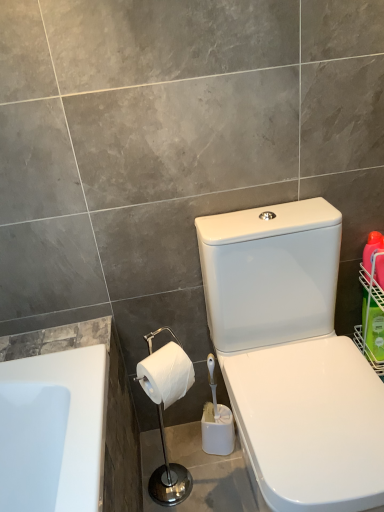
Question: From the image's perspective, is white glossy toilet at center-right beneath green plastic basket at right?

Choices:
 (A) no
 (B) yes

Answer: (B)

Question: Is white glossy toilet at center-right wider than green plastic basket at right?

Choices:
 (A) yes
 (B) no

Answer: (A)

Question: Is white glossy toilet at center-right at the right side of green plastic basket at right?

Choices:
 (A) yes
 (B) no

Answer: (B)

Question: Is white glossy toilet at center-right not close to green plastic basket at right?

Choices:
 (A) no
 (B) yes

Answer: (A)

Question: Is white glossy toilet at center-right turned away from green plastic basket at right?

Choices:
 (A) yes
 (B) no

Answer: (B)

Question: Considering the relative sizes of white glossy toilet at center-right and green plastic basket at right in the image provided, is white glossy toilet at center-right thinner than green plastic basket at right?

Choices:
 (A) no
 (B) yes

Answer: (A)

Question: Considering the relative sizes of white matte toilet paper at lower center and bright orange plastic bottle at right in the image provided, is white matte toilet paper at lower center bigger than bright orange plastic bottle at right?

Choices:
 (A) no
 (B) yes

Answer: (B)

Question: Does white matte toilet paper at lower center have a lesser width compared to bright orange plastic bottle at right?

Choices:
 (A) no
 (B) yes

Answer: (A)

Question: From the image's perspective, is white matte toilet paper at lower center beneath bright orange plastic bottle at right?

Choices:
 (A) no
 (B) yes

Answer: (B)

Question: Does white matte toilet paper at lower center touch bright orange plastic bottle at right?

Choices:
 (A) yes
 (B) no

Answer: (B)

Question: Is white matte toilet paper at lower center far from bright orange plastic bottle at right?

Choices:
 (A) yes
 (B) no

Answer: (B)

Question: Does white matte toilet paper at lower center have a greater width compared to bright orange plastic bottle at right?

Choices:
 (A) no
 (B) yes

Answer: (B)

Question: Is green plastic basket at right facing away from white glossy toilet at center-right?

Choices:
 (A) yes
 (B) no

Answer: (B)